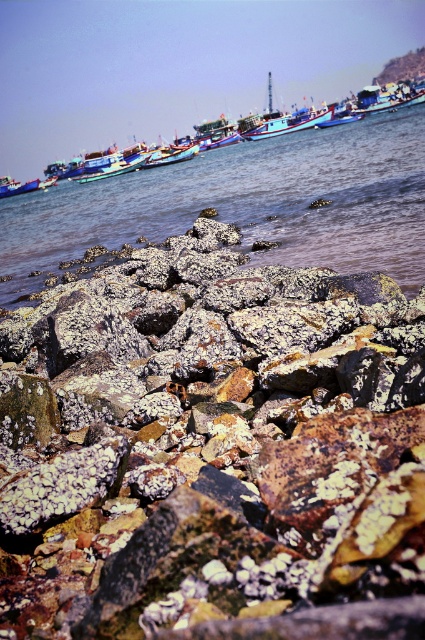
Question: Is clear water at center smaller than metallic blue boat at left?

Choices:
 (A) yes
 (B) no

Answer: (B)

Question: Among these objects, which one is nearest to the camera?

Choices:
 (A) metallic blue boat at center
 (B) wooden boat at center

Answer: (B)

Question: Is speckled rock at center positioned behind metallic blue boat at left?

Choices:
 (A) no
 (B) yes

Answer: (A)

Question: Which point appears farthest from the camera in this image?

Choices:
 (A) (319, 118)
 (B) (172, 168)
 (C) (16, 184)

Answer: (C)

Question: Is clear water at center above blue painted wooden boat at upper center?

Choices:
 (A) no
 (B) yes

Answer: (A)

Question: Which object is closer to the camera taking this photo?

Choices:
 (A) clear water at center
 (B) blue painted wooden boat at upper center
 (C) speckled rock at center
 (D) blue painted wooden boat at center

Answer: (C)